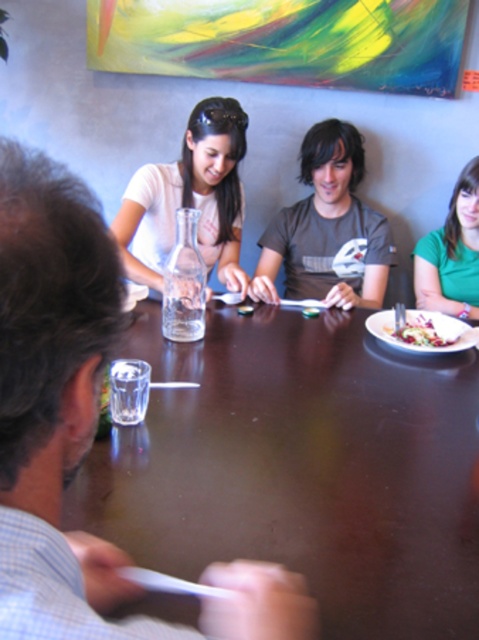
Is point (273, 252) less distant than point (376, 333)?

No, (273, 252) is behind (376, 333).

Is dark gray t-shirt at center positioned behind white matte plate at right?

Yes.

Where is `dark gray t-shirt at center`? This screenshot has width=479, height=640. dark gray t-shirt at center is located at coordinates (326, 227).

Can you confirm if smooth dark wood table at center is positioned to the right of green matte shirt at upper right?

Incorrect, smooth dark wood table at center is not on the right side of green matte shirt at upper right.

Measure the distance between smooth dark wood table at center and green matte shirt at upper right.

A distance of 31.60 inches exists between smooth dark wood table at center and green matte shirt at upper right.

Between point (168, 342) and point (466, 244), which one is positioned in front?

Point (168, 342) is more forward.

At what (x,y) coordinates should I click in order to perform the action: click on smooth dark wood table at center. Please return your answer as a coordinate pair (x, y). Looking at the image, I should click on (300, 467).

Does smooth dark wood table at center lie behind white matte plate at right?

That is False.

Which is behind, point (448, 515) or point (403, 353)?

Point (403, 353)

Who is more forward, (x=308, y=579) or (x=380, y=324)?

Point (x=308, y=579) is more forward.

The width and height of the screenshot is (479, 640). Identify the location of smooth dark wood table at center. (300, 467).